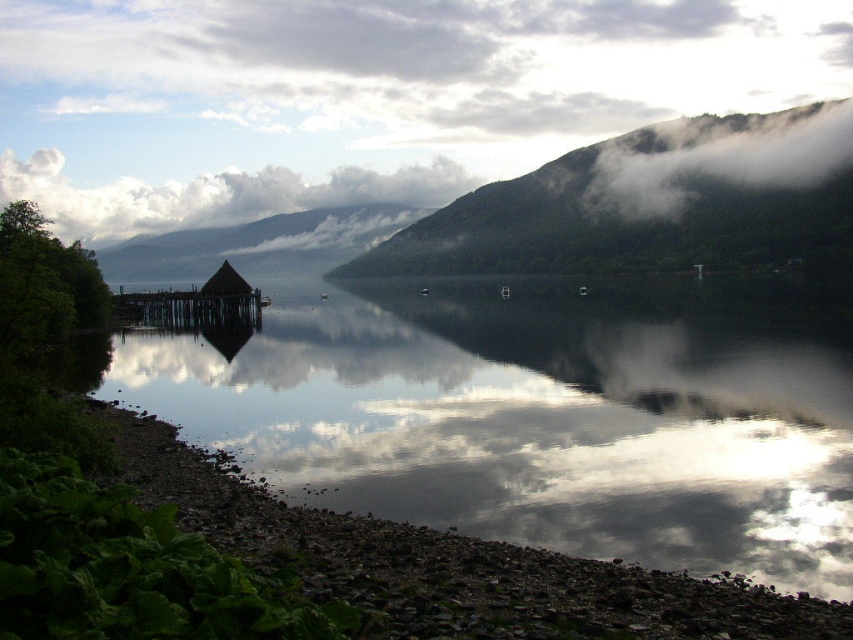
You are an artist trying to paint the scene. You want to ensure the white fluffy cloud at upper center and the brown wooden dock at left are proportionally accurate. Which object should you draw larger?

The white fluffy cloud at upper center should be drawn larger since it is larger in size than the brown wooden dock at left according to the description.